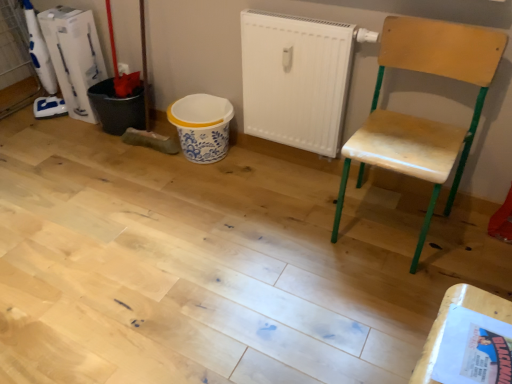
I want to click on vacant location below white matte radiator at center (from a real-world perspective), so click(297, 164).